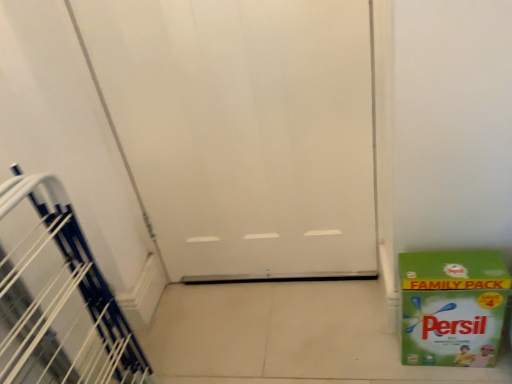
Question: Could white plastic stairwell at left be considered to be inside green paper box at lower right?

Choices:
 (A) no
 (B) yes

Answer: (A)

Question: From the image's perspective, is green paper box at lower right located beneath white plastic stairwell at left?

Choices:
 (A) no
 (B) yes

Answer: (A)

Question: Can you confirm if green paper box at lower right is positioned to the left of white plastic stairwell at left?

Choices:
 (A) no
 (B) yes

Answer: (A)

Question: Does green paper box at lower right have a smaller size compared to white plastic stairwell at left?

Choices:
 (A) no
 (B) yes

Answer: (B)

Question: Is green paper box at lower right facing away from white plastic stairwell at left?

Choices:
 (A) yes
 (B) no

Answer: (B)

Question: Is green paper box at lower right further to the viewer compared to white plastic stairwell at left?

Choices:
 (A) no
 (B) yes

Answer: (B)

Question: Is white matte door at center bigger than green paper box at lower right?

Choices:
 (A) yes
 (B) no

Answer: (A)

Question: Is white matte door at center at the left side of green paper box at lower right?

Choices:
 (A) yes
 (B) no

Answer: (A)

Question: Can we say white matte door at center lies outside green paper box at lower right?

Choices:
 (A) yes
 (B) no

Answer: (A)

Question: Is green paper box at lower right located within white matte door at center?

Choices:
 (A) yes
 (B) no

Answer: (B)

Question: Would you say white matte door at center is a long distance from green paper box at lower right?

Choices:
 (A) no
 (B) yes

Answer: (A)

Question: Is white matte door at center turned away from green paper box at lower right?

Choices:
 (A) yes
 (B) no

Answer: (B)

Question: From a real-world perspective, is white plastic stairwell at left on top of white matte door at center?

Choices:
 (A) yes
 (B) no

Answer: (B)